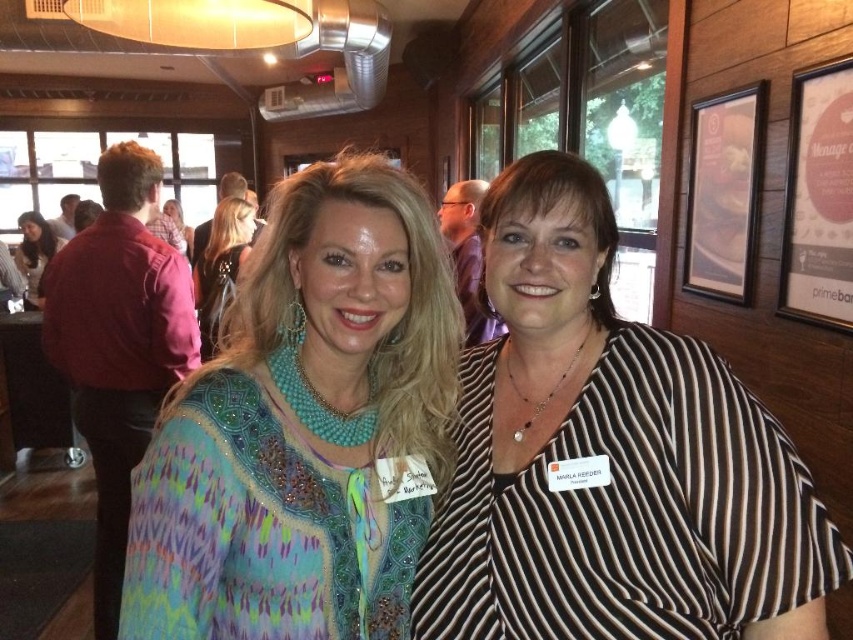
You are a photographer setting up for a group photo. You notice the shiny black hair at upper left and the teal beaded necklace at upper center in your frame. Which object is located lower in the image?

The shiny black hair at upper left is positioned under the teal beaded necklace at upper center, so it is located lower in the image.

You are a photographer trying to capture a clear shot of both the shiny black hair at upper left and the matte black hair at upper left. Since you need to focus on the one closer to you first, which one should you adjust your camera to focus on?

The shiny black hair at upper left is closer to the viewer than the matte black hair at upper left, so you should focus on the shiny black hair at upper left first.

Looking at this image, you are a photographer setting up a camera to take a group photo of two women wearing the striped fabric blouse at center and the multicolored beaded top at center. You want to ensure that both subjects are fully visible in the frame. Based on their clothing widths, which woman should you position closer to the camera to avoid cropping either of them?

The striped fabric blouse at center might be wider than the multicolored beaded top at center, so positioning the woman wearing the striped fabric blouse at center closer to the camera would help ensure both are fully visible without cropping.